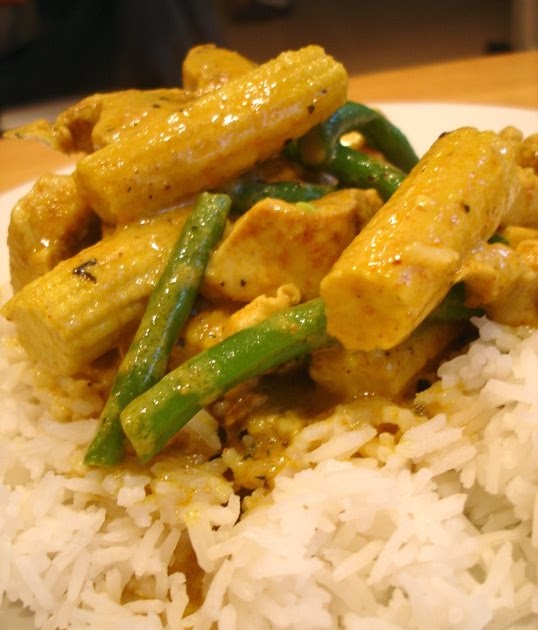
Locate an element on the screen. table is located at coordinates (525, 74).